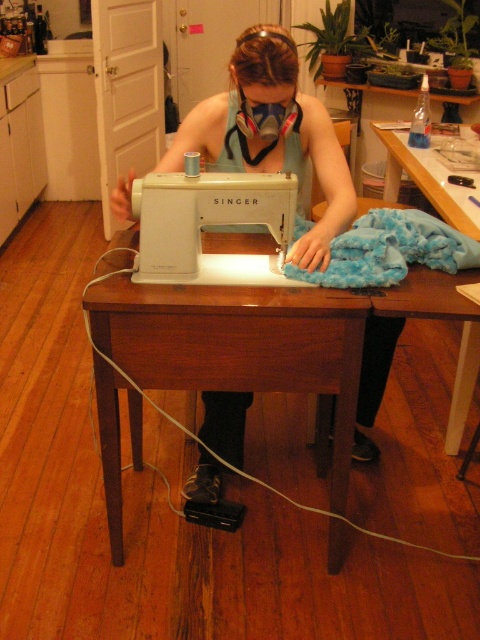
Does white plastic sewing machine at center appear on the left side of wooden table at lower right?

Correct, you'll find white plastic sewing machine at center to the left of wooden table at lower right.

Is white plastic sewing machine at center wider than wooden table at lower right?

Indeed, white plastic sewing machine at center has a greater width compared to wooden table at lower right.

Between point (266, 204) and point (444, 188), which one is positioned in front?

Point (266, 204) is more forward.

Where is `white plastic sewing machine at center`? The height and width of the screenshot is (640, 480). white plastic sewing machine at center is located at coordinates point(210,225).

Does matte white sewing machine at center have a lesser height compared to wooden table at lower right?

Yes.

Who is positioned more to the right, matte white sewing machine at center or wooden table at lower right?

Positioned to the right is wooden table at lower right.

The image size is (480, 640). Identify the location of matte white sewing machine at center. (271, 134).

Identify the location of brown wood table at center. This screenshot has width=480, height=640. (240, 355).

Who is shorter, brown wood table at center or white plastic sewing machine at center?

white plastic sewing machine at center is shorter.

The height and width of the screenshot is (640, 480). I want to click on brown wood table at center, so click(240, 355).